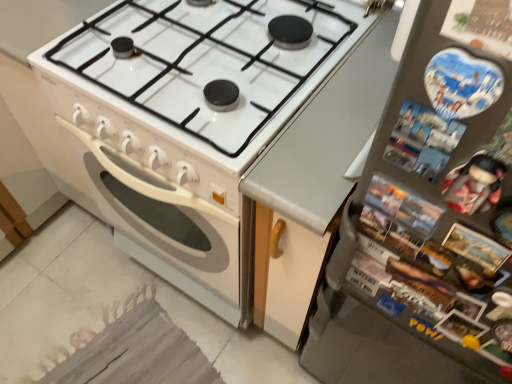
Where is `white glossy stove at center`? This screenshot has width=512, height=384. white glossy stove at center is located at coordinates (216, 126).

Image resolution: width=512 pixels, height=384 pixels. What do you see at coordinates (216, 126) in the screenshot?
I see `white glossy stove at center` at bounding box center [216, 126].

What is the approximate width of metallic gray refrigerator at right?

metallic gray refrigerator at right is 2.05 inches in width.

You are a GUI agent. You are given a task and a screenshot of the screen. Output one action in this format:
    pyautogui.click(x=<x>, y=<y>)
    Task: Click on the metallic gray refrigerator at right
    The height and width of the screenshot is (384, 512).
    Given the screenshot: What is the action you would take?
    pyautogui.click(x=429, y=218)

This screenshot has width=512, height=384. Describe the element at coordinates (429, 218) in the screenshot. I see `metallic gray refrigerator at right` at that location.

The image size is (512, 384). I want to click on white glossy stove at center, so click(216, 126).

Between metallic gray refrigerator at right and white glossy stove at center, which one appears on the right side from the viewer's perspective?

Positioned to the right is metallic gray refrigerator at right.

From the picture: Is metallic gray refrigerator at right further to camera compared to white glossy stove at center?

No, the depth of metallic gray refrigerator at right is less than that of white glossy stove at center.

Does point (369, 378) lie behind point (174, 108)?

Yes.

From the image's perspective, is metallic gray refrigerator at right under white glossy stove at center?

Indeed, from the image's perspective, metallic gray refrigerator at right is shown beneath white glossy stove at center.

From a real-world perspective, between metallic gray refrigerator at right and white glossy stove at center, who is vertically higher?

metallic gray refrigerator at right.

Can you confirm if metallic gray refrigerator at right is thinner than white glossy stove at center?

Indeed, metallic gray refrigerator at right has a lesser width compared to white glossy stove at center.

Considering the sizes of metallic gray refrigerator at right and white glossy stove at center in the image, is metallic gray refrigerator at right taller or shorter than white glossy stove at center?

Clearly, metallic gray refrigerator at right is taller compared to white glossy stove at center.

Is metallic gray refrigerator at right smaller than white glossy stove at center?

Indeed, metallic gray refrigerator at right has a smaller size compared to white glossy stove at center.

Would you say metallic gray refrigerator at right contains white glossy stove at center?

No, white glossy stove at center is not surrounded by metallic gray refrigerator at right.

Is metallic gray refrigerator at right touching white glossy stove at center?

There is a gap between metallic gray refrigerator at right and white glossy stove at center.

Is metallic gray refrigerator at right turned away from white glossy stove at center?

No, metallic gray refrigerator at right's orientation is not away from white glossy stove at center.

How different are the orientations of metallic gray refrigerator at right and white glossy stove at center in degrees?

The angular difference between metallic gray refrigerator at right and white glossy stove at center is 1.7 degrees.

You are a GUI agent. You are given a task and a screenshot of the screen. Output one action in this format:
    pyautogui.click(x=<x>, y=<y>)
    Task: Click on the appliance above the metallic gray refrigerator at right (from the image's perspective)
    
    Given the screenshot: What is the action you would take?
    pyautogui.click(x=216, y=126)

In the scene shown: Considering the positions of objects white glossy stove at center and metallic gray refrigerator at right in the image provided, who is more to the right, white glossy stove at center or metallic gray refrigerator at right?

From the viewer's perspective, metallic gray refrigerator at right appears more on the right side.

In the image, is white glossy stove at center positioned in front of or behind metallic gray refrigerator at right?

Visually, white glossy stove at center is located behind metallic gray refrigerator at right.

Does point (374, 90) lie in front of point (372, 328)?

Yes, point (374, 90) is closer to viewer.

From the image's perspective, is white glossy stove at center positioned above or below metallic gray refrigerator at right?

Based on their image positions, white glossy stove at center is located above metallic gray refrigerator at right.

From a real-world perspective, is white glossy stove at center positioned under metallic gray refrigerator at right based on gravity?

Yes, from a real-world perspective, white glossy stove at center is under metallic gray refrigerator at right.

Is white glossy stove at center wider or thinner than metallic gray refrigerator at right?

Clearly, white glossy stove at center has more width compared to metallic gray refrigerator at right.

Who is shorter, white glossy stove at center or metallic gray refrigerator at right?

Standing shorter between the two is white glossy stove at center.

Who is bigger, white glossy stove at center or metallic gray refrigerator at right?

With larger size is white glossy stove at center.

Based on the photo, would you say metallic gray refrigerator at right is part of white glossy stove at center's contents?

No, metallic gray refrigerator at right is not a part of white glossy stove at center.

Is white glossy stove at center not close to metallic gray refrigerator at right?

No, white glossy stove at center is not far from metallic gray refrigerator at right.

Is white glossy stove at center turned away from metallic gray refrigerator at right?

white glossy stove at center is not turned away from metallic gray refrigerator at right.

Can you tell me how much white glossy stove at center and metallic gray refrigerator at right differ in facing direction?

1.7 degrees separate the facing orientations of white glossy stove at center and metallic gray refrigerator at right.

The width and height of the screenshot is (512, 384). What are the coordinates of `refrigerator located above the white glossy stove at center (from a real-world perspective)` in the screenshot? It's located at pyautogui.click(x=429, y=218).

This screenshot has height=384, width=512. Find the location of `appliance on the left of metallic gray refrigerator at right`. appliance on the left of metallic gray refrigerator at right is located at coordinates (216, 126).

Locate an element on the screen. The image size is (512, 384). refrigerator located in front of the white glossy stove at center is located at coordinates (429, 218).